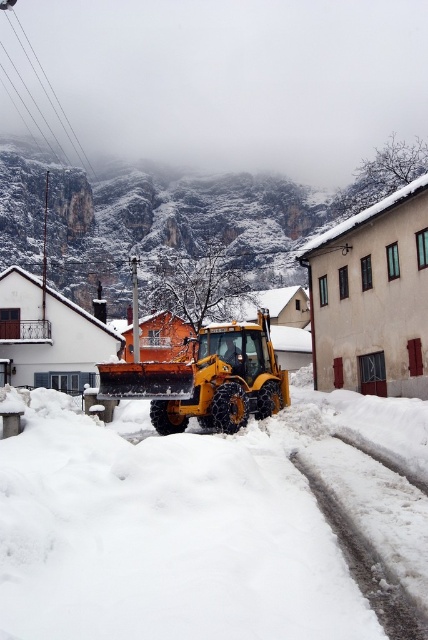
Question: Is white fluffy snow at center wider than yellow rubber plow at center?

Choices:
 (A) no
 (B) yes

Answer: (B)

Question: Among these objects, which one is nearest to the camera?

Choices:
 (A) white fluffy snow at center
 (B) yellow rubber plow at center

Answer: (A)

Question: Which point is closer to the camera taking this photo?

Choices:
 (A) (136, 378)
 (B) (240, 611)

Answer: (B)

Question: Is white fluffy snow at center above yellow rubber plow at center?

Choices:
 (A) no
 (B) yes

Answer: (A)

Question: Can you confirm if white fluffy snow at center is positioned below yellow rubber plow at center?

Choices:
 (A) no
 (B) yes

Answer: (B)